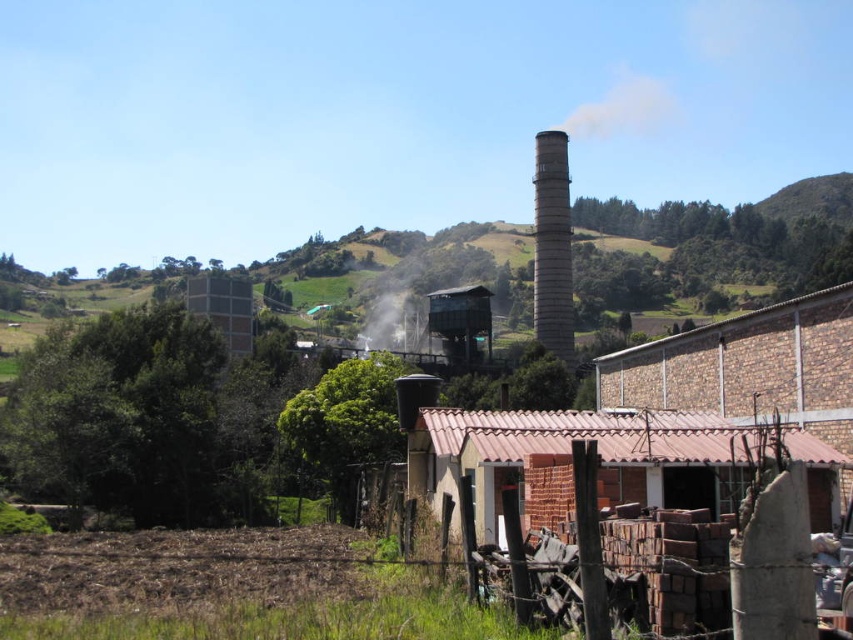
Question: Which of the following is the farthest from the observer?

Choices:
 (A) brown brick hut at lower right
 (B) brown wooden fence at lower right
 (C) metallic gray tower at center

Answer: (C)

Question: Is brown wooden fence at lower right to the left of gray concrete chimney at upper center from the viewer's perspective?

Choices:
 (A) yes
 (B) no

Answer: (A)

Question: Which object appears farthest from the camera in this image?

Choices:
 (A) metallic gray tower at center
 (B) gray concrete chimney at upper center
 (C) brown brick hut at lower right
 (D) white translucent smoke at center

Answer: (D)

Question: Is brown brick hut at lower right positioned at the back of brown wooden fence at lower right?

Choices:
 (A) no
 (B) yes

Answer: (B)

Question: Does brown brick hut at lower right appear on the right side of white translucent smoke at center?

Choices:
 (A) no
 (B) yes

Answer: (B)

Question: Which point is closer to the camera?

Choices:
 (A) brown wooden fence at lower right
 (B) brown brick hut at lower right
 (C) white translucent smoke at center

Answer: (A)